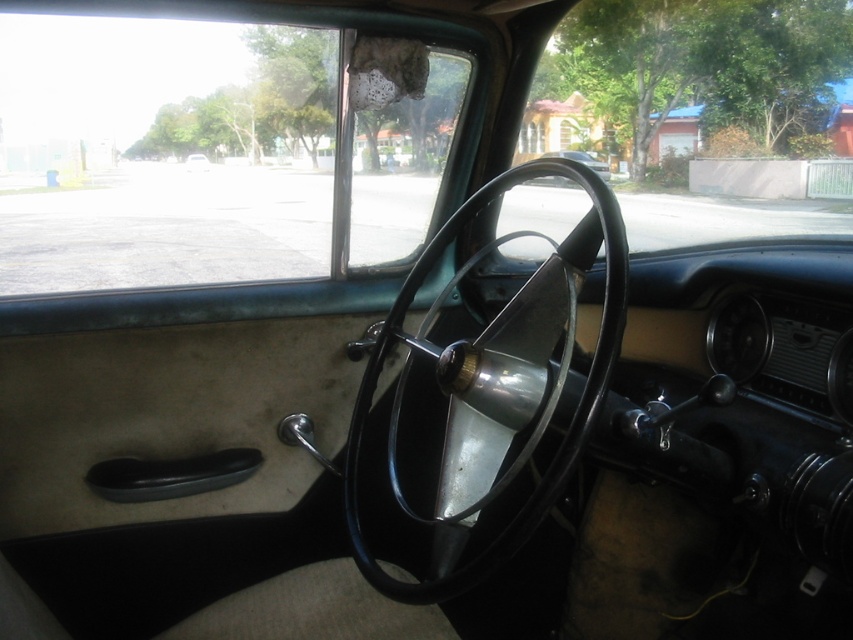
You are sitting in the driver seat of the vintage car and want to adjust the radio knob located on the dashboard. To reach it, you need to move your hand from the metallic silver steering wheel at center. In which direction should you move your hand relative to the steering wheel?

The metallic silver steering wheel at center is located at point (498, 387). Since the dashboard is on the right side of the image, you should move your hand to the right to reach the radio knob on the dashboard.

Consider the image. You are sitting in the driver seat of the metallic silver car at center. Looking forward, where is the metallic silver steering wheel at center located relative to you?

The metallic silver steering wheel at center is to the left of the metallic silver car at center, so it is positioned to the left of your current position in the driver seat.

You are sitting in the driver seat of the vintage car and looking at the steering wheel and the dashboard. There are two points marked in the image, one at point (538, 435) and the other at point (537, 180). Which point is closer to you?

Point (538, 435) is in front of point (537, 180), so it is closer to you.